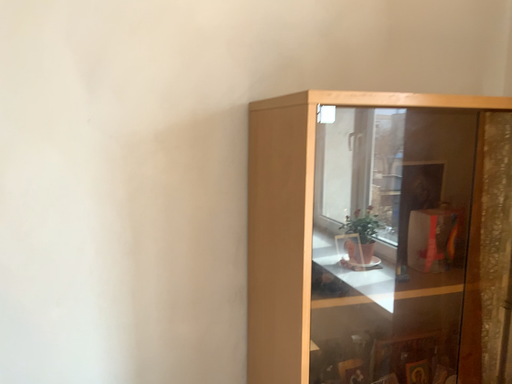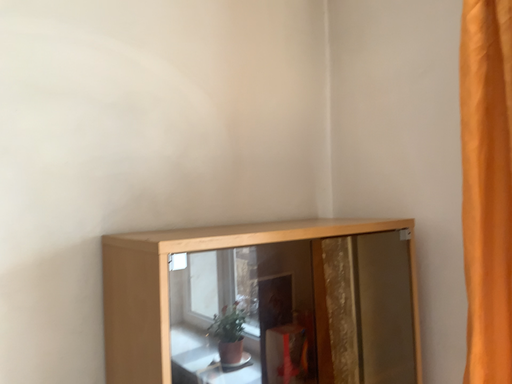
Question: Which way did the camera rotate in the video?

Choices:
 (A) rotated left
 (B) rotated right

Answer: (B)